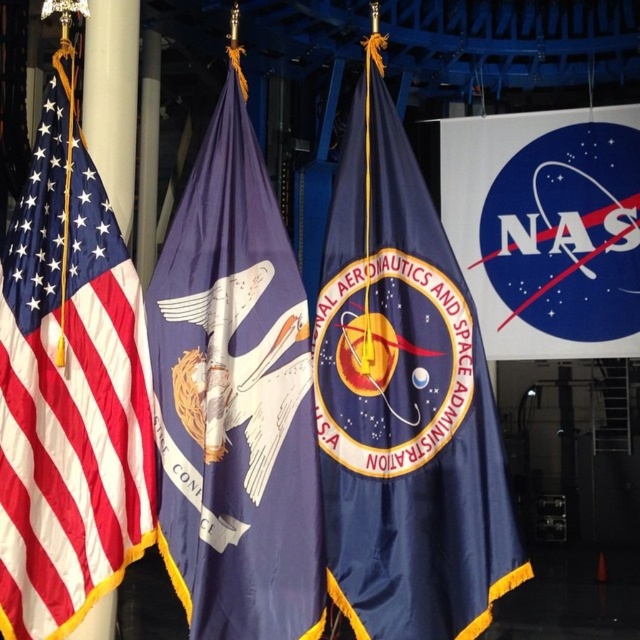
You are standing in front of three flags displayed against a NASA backdrop. You notice the navy blue satin NASA flag at center and the matte fabric flag at left. Which flag is positioned closer to you?

The navy blue satin NASA flag at center is closer to the viewer than the matte fabric flag at left.

In the scene shown: You are standing in front of the three flags displayed against the NASA backdrop. You need to place a new flag that is 2 meters wide between the navy blue satin nasa flag at center and the matte blue flag with white emblem at center. Is there enough space between them to fit your new flag?

The navy blue satin nasa flag at center is 2.73 meters away from the matte blue flag with white emblem at center. Since the distance between them is greater than the width of your new flag, there is enough space to fit the 2 meters wide flag between them.